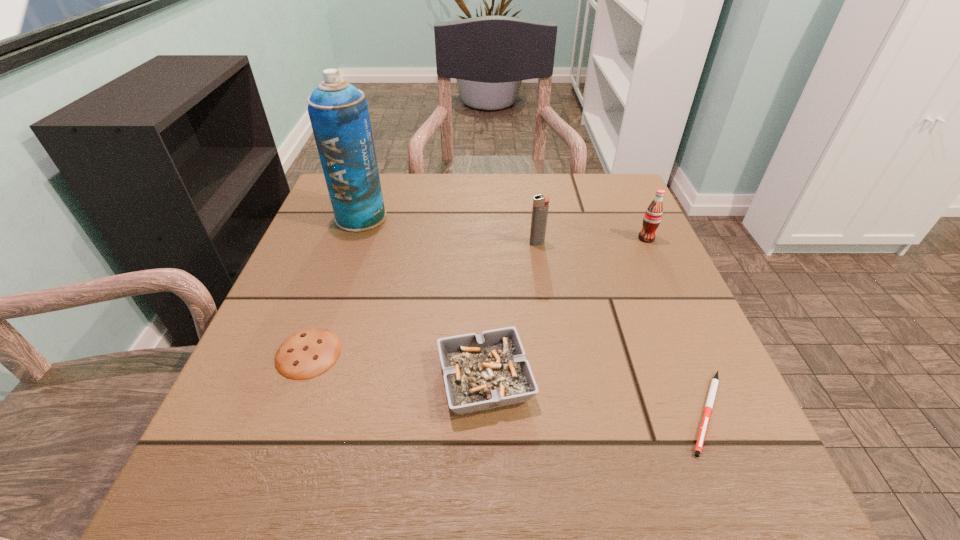
Identify the location of object that is the second closest one to the soda. This screenshot has width=960, height=540. (714, 384).

At what (x,y) coordinates should I click in order to perform the action: click on free location that satisfies the following two spatial constraints: 1. on the back side of the soda; 2. on the left side of the igniter. Please return your answer as a coordinate pair (x, y). The height and width of the screenshot is (540, 960). Looking at the image, I should click on (536, 238).